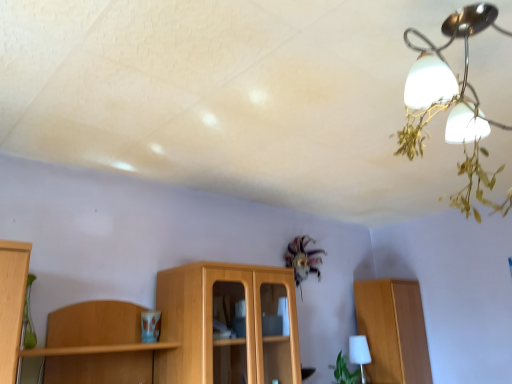
Question: Is wooden cabinet at right inside the boundaries of green leafy plant at lower right, or outside?

Choices:
 (A) outside
 (B) inside

Answer: (A)

Question: Is wooden cabinet at right wider or thinner than green leafy plant at lower right?

Choices:
 (A) thin
 (B) wide

Answer: (B)

Question: Which object is the farthest from the green leafy plant at lower right?

Choices:
 (A) white matte table lamp at lower right
 (B) wooden cabinet at right
 (C) satin silver chandelier at upper right

Answer: (C)

Question: Considering the real-world distances, which object is closest to the wooden cabinet at right?

Choices:
 (A) white matte table lamp at lower right
 (B) satin silver chandelier at upper right
 (C) green leafy plant at lower right

Answer: (A)